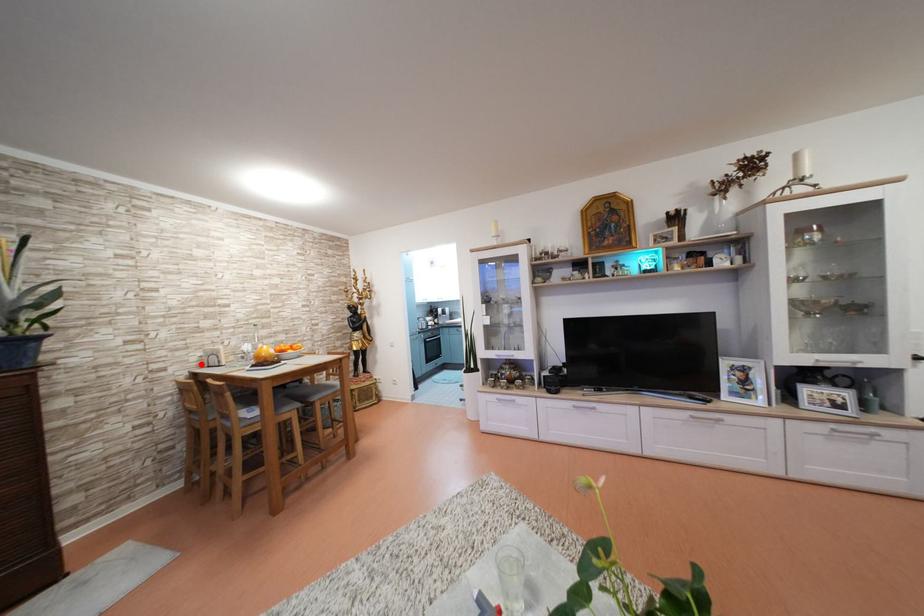
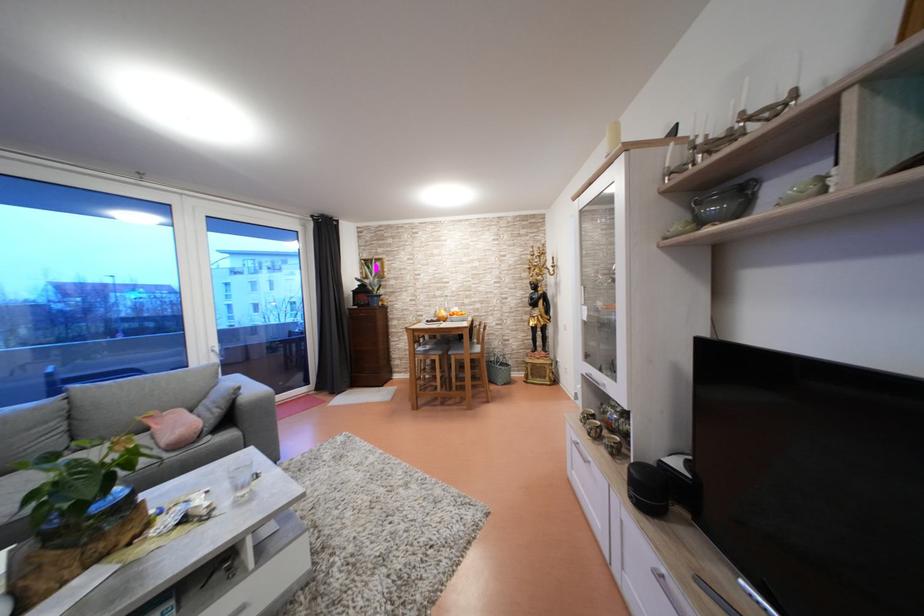
The point at the highlighted location is marked in the first image. Where is the corresponding point in the second image?

(440, 318)